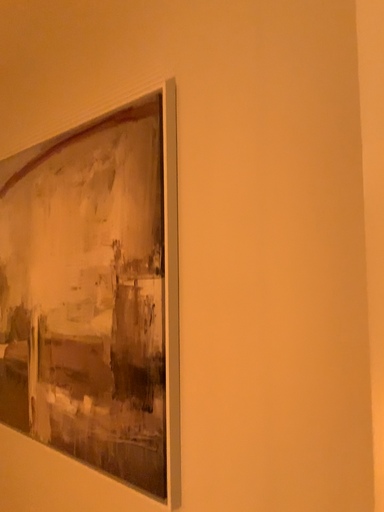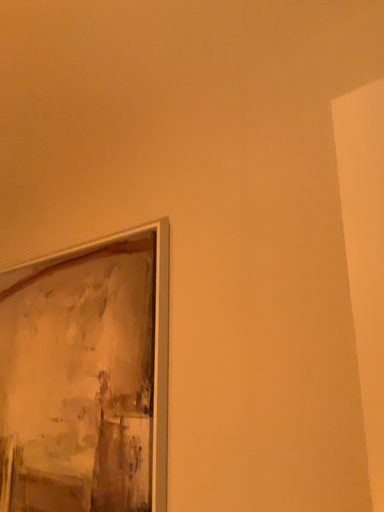
Question: How did the camera likely rotate when shooting the video?

Choices:
 (A) rotated upward
 (B) rotated downward

Answer: (A)